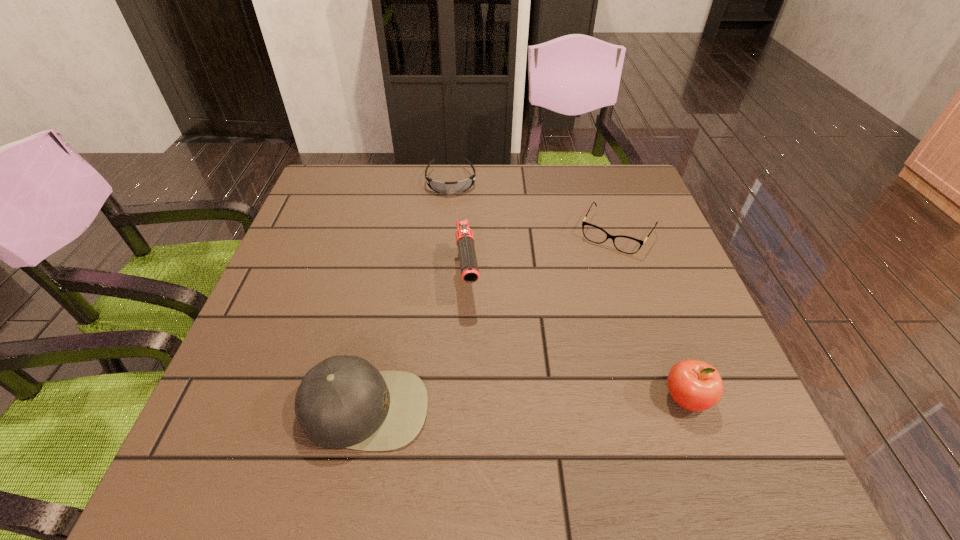
Locate an element on the screen. Image resolution: width=960 pixels, height=540 pixels. apple at the right edge is located at coordinates pyautogui.click(x=694, y=385).

This screenshot has width=960, height=540. Identify the location of spectacles situated at the right edge. (629, 245).

You are a GUI agent. You are given a task and a screenshot of the screen. Output one action in this format:
    pyautogui.click(x=<x>, y=<y>)
    Task: Click on the object that is at the near left corner
    
    Given the screenshot: What is the action you would take?
    pyautogui.click(x=342, y=402)

The height and width of the screenshot is (540, 960). Find the location of `object that is at the far right corner`. object that is at the far right corner is located at coordinates (629, 245).

Identify the location of object situated at the near right corner. This screenshot has height=540, width=960. (694, 385).

Locate an element on the screen. The height and width of the screenshot is (540, 960). free space at the far edge of the desktop is located at coordinates (516, 178).

This screenshot has width=960, height=540. In order to click on vacant area at the left edge of the desktop in this screenshot , I will do 324,308.

Where is `vacant space at the right edge`? The height and width of the screenshot is (540, 960). vacant space at the right edge is located at coordinates (663, 237).

Find the location of a particular element. This screenshot has width=960, height=540. vacant area at the far right corner of the desktop is located at coordinates (621, 178).

Identify the location of empty space that is in between the apple and the cap. (525, 403).